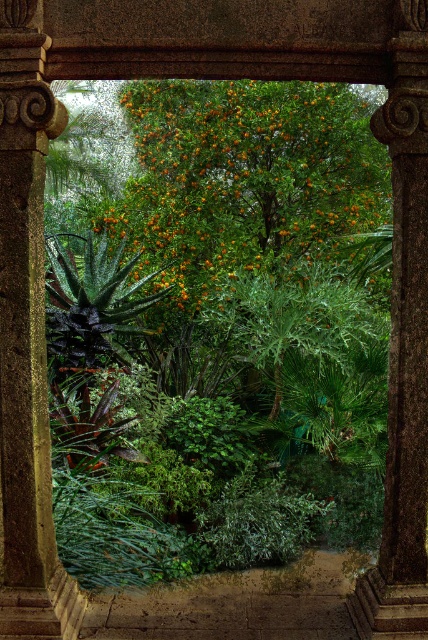
You are a gardener standing in the garden and want to water the green leafy orange tree at center and the smooth stone column at left. Which one is closer to the left side of the archway?

The smooth stone column at left is closer to the left side of the archway because it is positioned to the left of the green leafy orange tree at center.

You are standing in front of the garden framed by the ancient columns. You see two points marked in the scene. Which point is closer to you, point (341, 90) or point (14, 410)?

Point (341, 90) is further to the viewer than point (14, 410). Therefore, point (14, 410) is closer to you.

You are a gardener who wants to plant a new tree in this garden. The new tree will be the same size as the smooth stone column at left. Based on the existing green leafy orange tree at center, will there be enough space to plant the new tree without overcrowding the area?

The green leafy orange tree at center is larger in size than the smooth stone column at left. Since the new tree will be the same size as the smooth stone column at left, it will be smaller than the existing tree. Therefore, there should be enough space to plant the new tree without overcrowding the area.